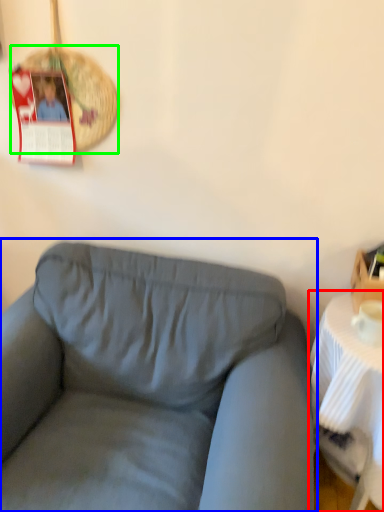
Question: Estimate the real-world distances between objects in this image. Which object is farther from table (highlighted by a red box), studio couch (highlighted by a blue box) or basket (highlighted by a green box)?

Choices:
 (A) studio couch
 (B) basket

Answer: (B)